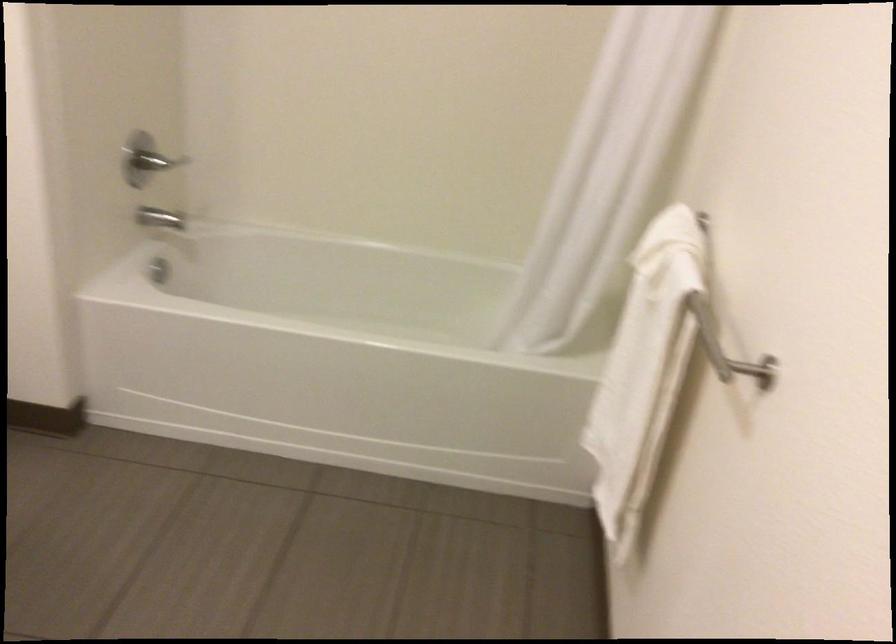
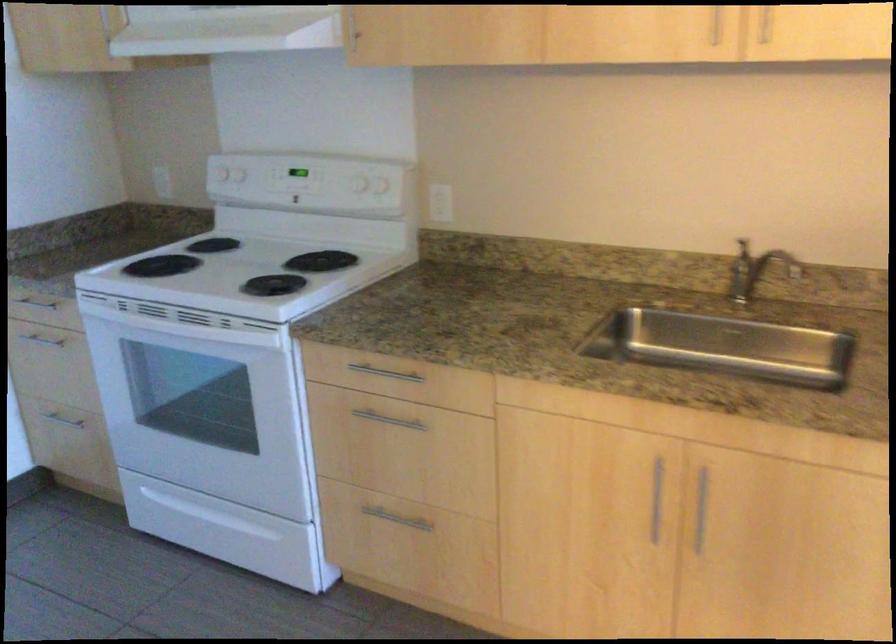
Question: The first image is from the beginning of the video and the second image is from the end. How did the camera likely rotate when shooting the video?

Choices:
 (A) Left
 (B) Right
 (C) Up
 (D) Down

Answer: (B)